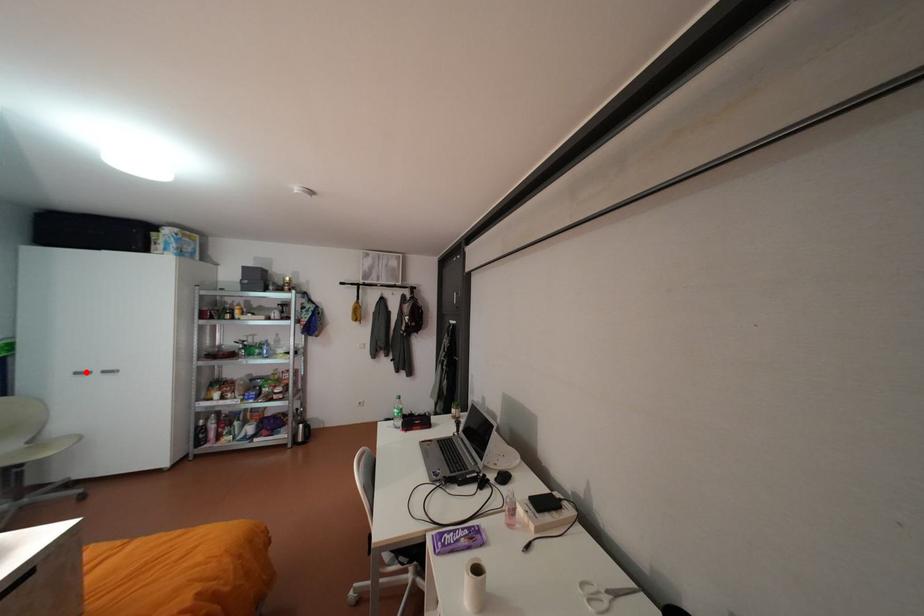
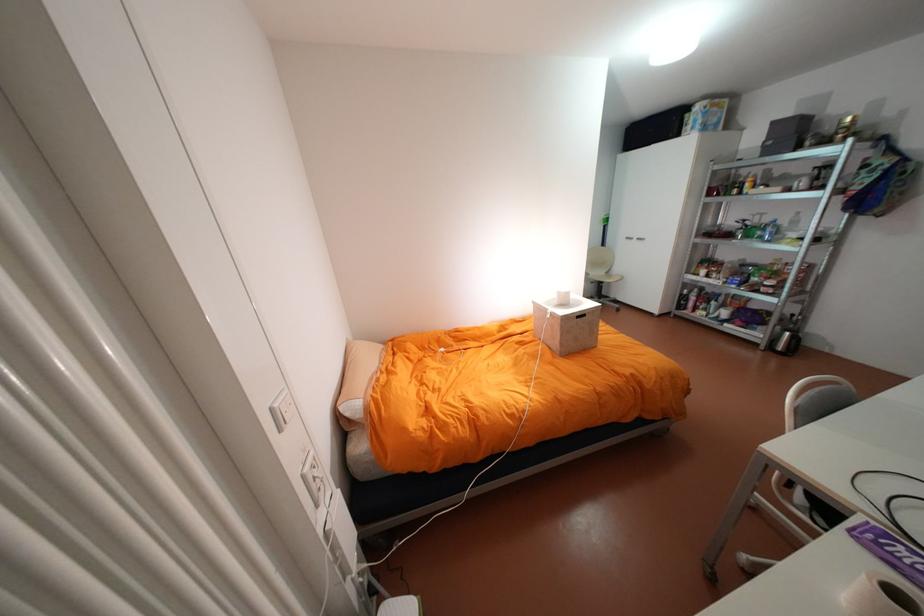
Question: I am providing you with two images of the same scene from different viewpoints. In image1, a red point is highlighted. Considering the same 3D point in image2, which of the following is correct?

Choices:
 (A) It is closer
 (B) It is farther

Answer: (A)